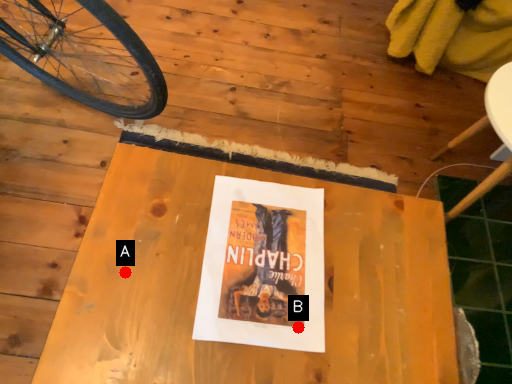
Question: Two points are circled on the image, labeled by A and B beside each circle. Which point is farther from the camera taking this photo?

Choices:
 (A) A is further
 (B) B is further

Answer: (A)